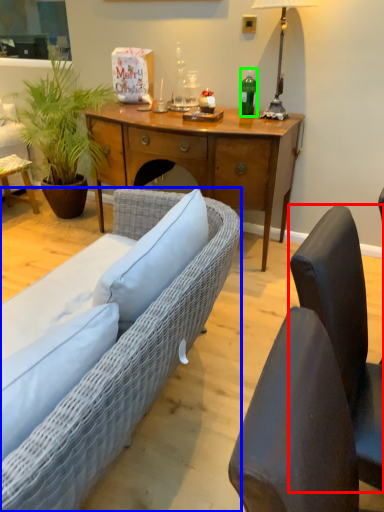
Question: Which object is the farthest from chair (highlighted by a red box)? Choose among these: studio couch (highlighted by a blue box) or bottle (highlighted by a green box).

Choices:
 (A) studio couch
 (B) bottle

Answer: (B)